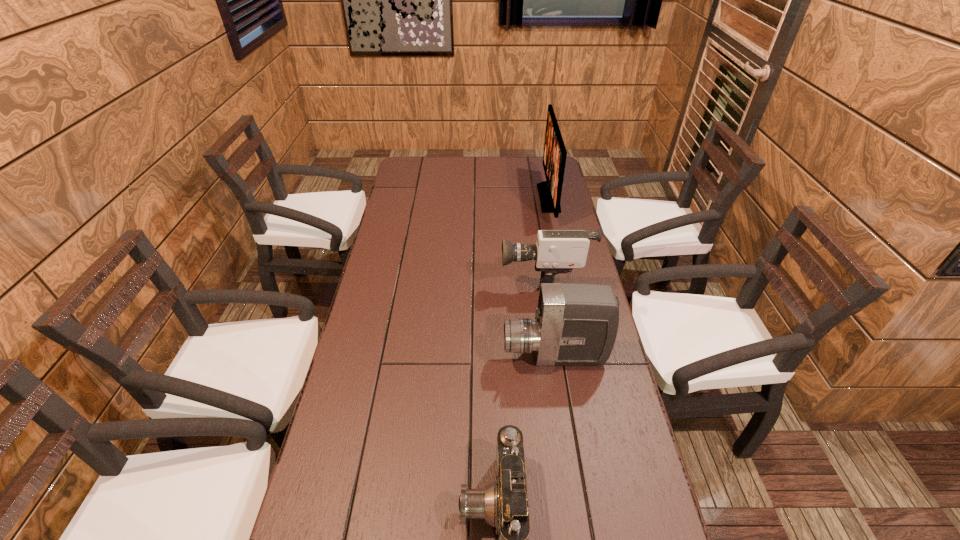
Locate an element on the screen. vacant space at the far right corner is located at coordinates (534, 182).

Locate which object ranks second in proximity to the second farthest object. Please provide its 2D coordinates. Your answer should be formatted as a tuple, i.e. [(x, y)], where the tuple contains the x and y coordinates of a point satisfying the conditions above.

[(575, 324)]

In order to click on object that is the third closest to the third nearest object in this screenshot , I will do `click(503, 504)`.

Identify which camcorder is located as the nearest to the nearest camcorder. Please provide its 2D coordinates. Your answer should be formatted as a tuple, i.e. [(x, y)], where the tuple contains the x and y coordinates of a point satisfying the conditions above.

[(575, 324)]

Select which camcorder appears as the second closest to the monitor. Please provide its 2D coordinates. Your answer should be formatted as a tuple, i.e. [(x, y)], where the tuple contains the x and y coordinates of a point satisfying the conditions above.

[(575, 324)]